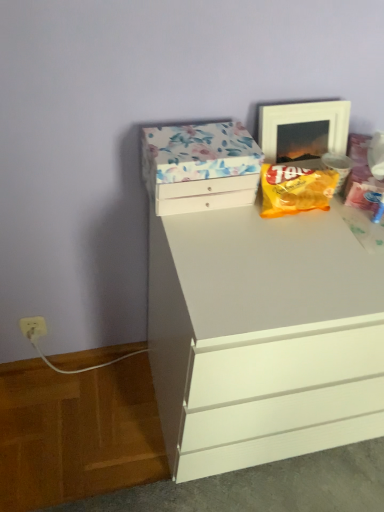
I want to click on free space above white matte chest of drawers at center (from a real-world perspective), so click(x=294, y=242).